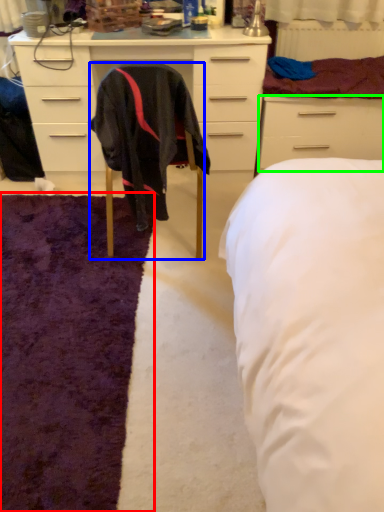
Question: Estimate the real-world distances between objects in this image. Which object is closer to mat (highlighted by a red box), chair (highlighted by a blue box) or drawer (highlighted by a green box)?

Choices:
 (A) chair
 (B) drawer

Answer: (A)